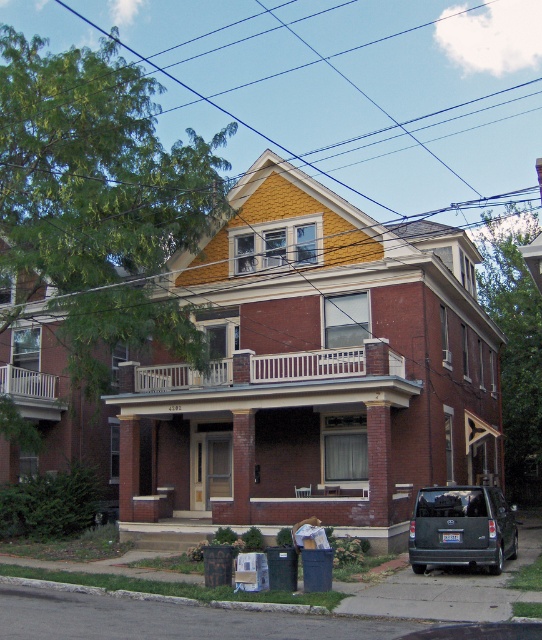
You are a delivery driver arriving at house number 4202. You have a large package to deliver. The entrance is on the side of the house where the house number is located. You see a dark gray matte suv at lower right and a white wooden balcony at lower left. Which object is closer to the entrance door where the house number is displayed?

The white wooden balcony at lower left is closer to the entrance door because it is located above the entrance porch, while the dark gray matte suv at lower right is positioned further away near the driveway.

You are a delivery person arriving at house number 4202. You see the dark gray matte suv at lower right and the white wooden balcony at lower left. Which object is closer to the entrance door?

The dark gray matte suv at lower right is closer to the entrance door because it is positioned in front of the white wooden balcony at lower left, which is behind it.

You are a delivery person standing at the entrance of the house. You need to park your delivery van, which is 6 meters long, between the dark gray matte suv at lower right and the white wooden balcony at lower left. Is there enough space for your van?

The distance between the dark gray matte suv at lower right and the white wooden balcony at lower left is 14.00 meters. Since the van is 6 meters long, there is sufficient space to park it between them.